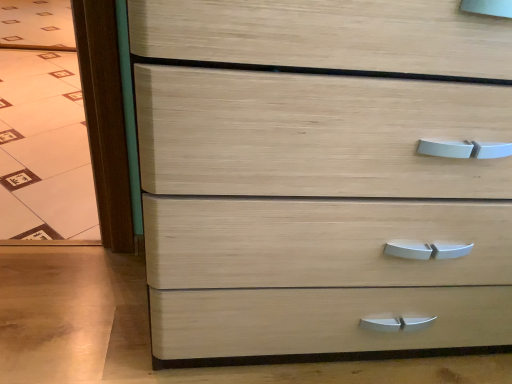
Question: Is transparent glass door at left outside of natural wood chest of drawers at center?

Choices:
 (A) yes
 (B) no

Answer: (A)

Question: Can you confirm if transparent glass door at left is smaller than natural wood chest of drawers at center?

Choices:
 (A) yes
 (B) no

Answer: (A)

Question: Is transparent glass door at left far away from natural wood chest of drawers at center?

Choices:
 (A) no
 (B) yes

Answer: (A)

Question: Does transparent glass door at left have a greater width compared to natural wood chest of drawers at center?

Choices:
 (A) no
 (B) yes

Answer: (B)

Question: From the image's perspective, is transparent glass door at left beneath natural wood chest of drawers at center?

Choices:
 (A) yes
 (B) no

Answer: (B)

Question: Does transparent glass door at left touch natural wood chest of drawers at center?

Choices:
 (A) no
 (B) yes

Answer: (A)

Question: Does natural wood chest of drawers at center appear on the left side of transparent glass door at left?

Choices:
 (A) yes
 (B) no

Answer: (B)

Question: Is the depth of natural wood chest of drawers at center greater than that of transparent glass door at left?

Choices:
 (A) no
 (B) yes

Answer: (A)

Question: Is natural wood chest of drawers at center facing away from transparent glass door at left?

Choices:
 (A) yes
 (B) no

Answer: (B)

Question: Can you confirm if natural wood chest of drawers at center is positioned to the right of transparent glass door at left?

Choices:
 (A) yes
 (B) no

Answer: (A)

Question: Considering the relative sizes of natural wood chest of drawers at center and transparent glass door at left in the image provided, is natural wood chest of drawers at center bigger than transparent glass door at left?

Choices:
 (A) yes
 (B) no

Answer: (A)

Question: Is natural wood chest of drawers at center outside transparent glass door at left?

Choices:
 (A) no
 (B) yes

Answer: (B)

Question: Looking at the image, does natural wood chest of drawers at center seem bigger or smaller compared to transparent glass door at left?

Choices:
 (A) small
 (B) big

Answer: (B)